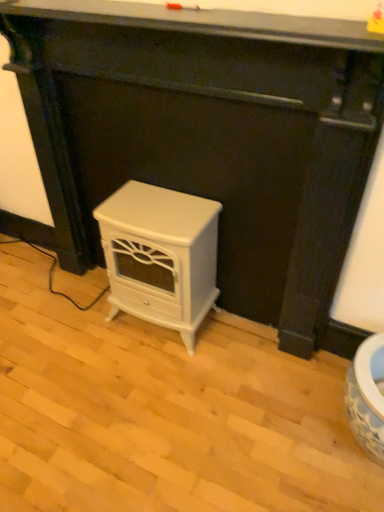
Question: Is white glossy electric stove at center, the 1th furniture positioned from the left, aimed at smooth black surface at upper center?

Choices:
 (A) no
 (B) yes

Answer: (A)

Question: Can you confirm if white glossy electric stove at center, the 1th furniture positioned from the left, is shorter than smooth black surface at upper center?

Choices:
 (A) no
 (B) yes

Answer: (A)

Question: Can you confirm if white glossy electric stove at center, arranged as the second furniture when viewed from the right, is bigger than smooth black surface at upper center?

Choices:
 (A) yes
 (B) no

Answer: (A)

Question: From the image's perspective, would you say white glossy electric stove at center, arranged as the second furniture when viewed from the right, is positioned over smooth black surface at upper center?

Choices:
 (A) no
 (B) yes

Answer: (A)

Question: Is smooth black surface at upper center at the back of white glossy electric stove at center, arranged as the second furniture when viewed from the right?

Choices:
 (A) no
 (B) yes

Answer: (A)

Question: Based on their sizes in the image, would you say smooth black surface at upper center is bigger or smaller than white glossy electric stove at center, the 1th furniture positioned from the left?

Choices:
 (A) small
 (B) big

Answer: (A)

Question: In terms of width, does smooth black surface at upper center look wider or thinner when compared to white glossy electric stove at center, the 1th furniture positioned from the left?

Choices:
 (A) wide
 (B) thin

Answer: (B)

Question: In the image, is smooth black surface at upper center on the left side or the right side of white glossy electric stove at center, the 1th furniture positioned from the left?

Choices:
 (A) left
 (B) right

Answer: (A)

Question: From the image's perspective, is smooth black surface at upper center positioned above or below white glossy electric stove at center, the 1th furniture positioned from the left?

Choices:
 (A) above
 (B) below

Answer: (A)

Question: Does point (137, 311) appear closer or farther from the camera than point (167, 25)?

Choices:
 (A) closer
 (B) farther

Answer: (B)

Question: Considering the positions of white glossy electric stove at center, the 1th furniture positioned from the left, and smooth black surface at upper center in the image, is white glossy electric stove at center, the 1th furniture positioned from the left, taller or shorter than smooth black surface at upper center?

Choices:
 (A) tall
 (B) short

Answer: (A)

Question: Would you say white glossy electric stove at center, the 1th furniture positioned from the left, is inside or outside smooth black surface at upper center?

Choices:
 (A) inside
 (B) outside

Answer: (B)

Question: Considering the positions of white glossy electric stove at center, arranged as the second furniture when viewed from the right, and smooth black surface at upper center in the image, is white glossy electric stove at center, arranged as the second furniture when viewed from the right, wider or thinner than smooth black surface at upper center?

Choices:
 (A) wide
 (B) thin

Answer: (A)

Question: In terms of height, does smooth black surface at upper center look taller or shorter compared to white glossy stove at center, placed as the 2th furniture when sorted from left to right?

Choices:
 (A) tall
 (B) short

Answer: (B)

Question: Considering the positions of smooth black surface at upper center and white glossy stove at center, which is the first furniture in right-to-left order, in the image, is smooth black surface at upper center bigger or smaller than white glossy stove at center, which is the first furniture in right-to-left order,?

Choices:
 (A) small
 (B) big

Answer: (A)